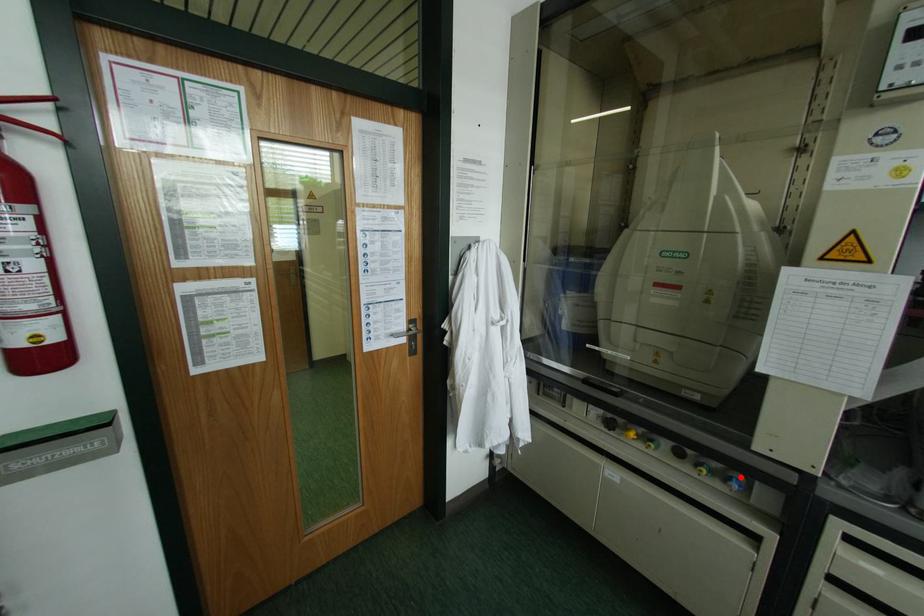
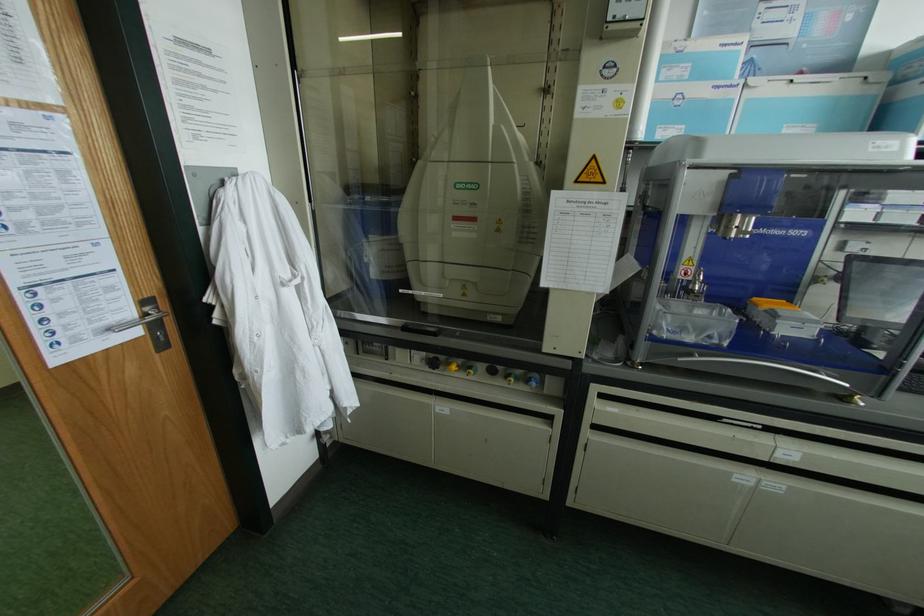
Where in the second image is the point corresponding to the highlighted location from the first image?

(536, 376)